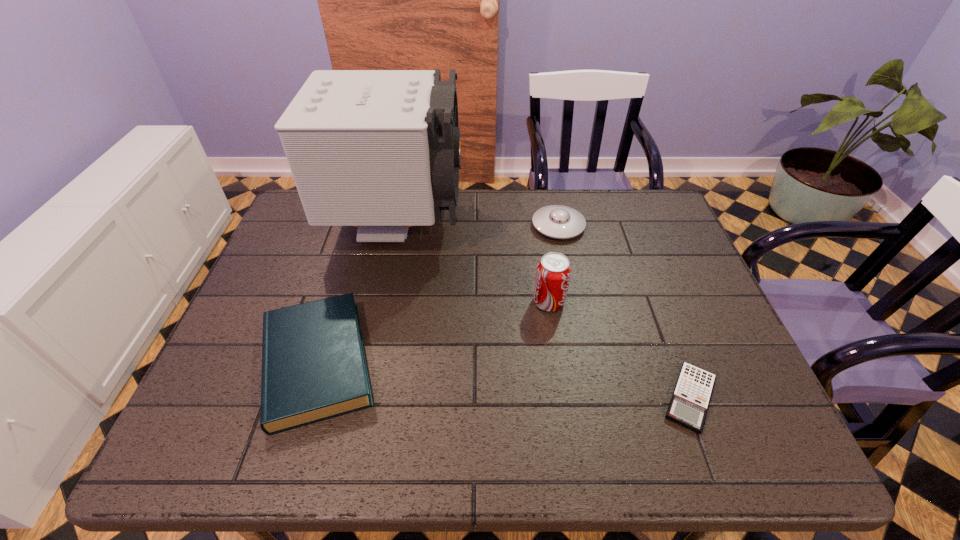
The width and height of the screenshot is (960, 540). In order to click on vacant space located on the left of the calculator in this screenshot , I will do `click(577, 398)`.

Find the location of a particular element. The width and height of the screenshot is (960, 540). fan that is positioned at the far edge is located at coordinates (380, 150).

Image resolution: width=960 pixels, height=540 pixels. In order to click on saucer that is at the far edge in this screenshot , I will do `click(556, 221)`.

The width and height of the screenshot is (960, 540). I want to click on book located at the near edge, so click(x=314, y=368).

Find the location of `calculator that is at the near edge`. calculator that is at the near edge is located at coordinates (688, 407).

Where is `fan located in the left edge section of the desktop`? fan located in the left edge section of the desktop is located at coordinates (380, 150).

Find the location of a particular element. book that is at the left edge is located at coordinates (314, 368).

The height and width of the screenshot is (540, 960). I want to click on object that is at the right edge, so click(x=688, y=407).

Locate an element on the screen. Image resolution: width=960 pixels, height=540 pixels. object located at the far left corner is located at coordinates (380, 150).

Locate an element on the screen. This screenshot has width=960, height=540. object at the near left corner is located at coordinates (314, 368).